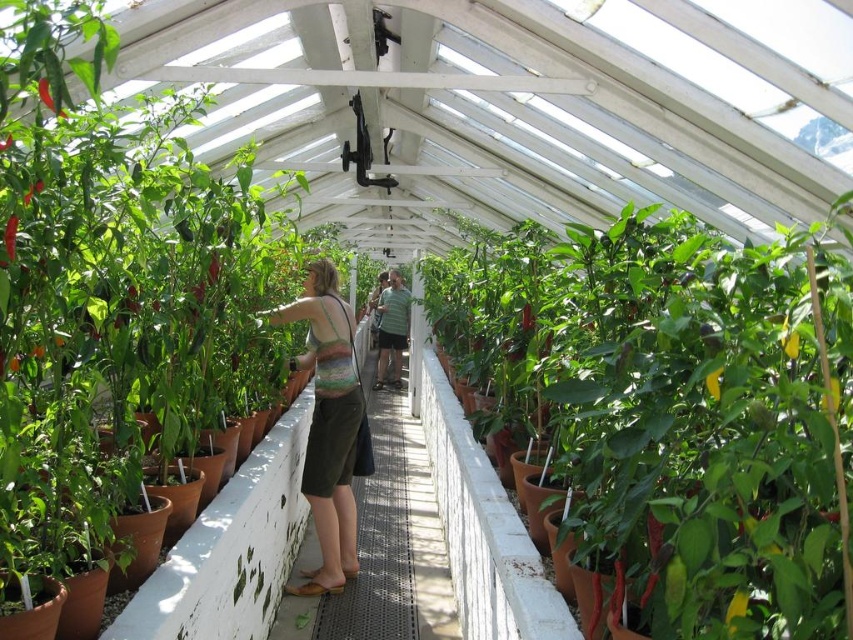
You are standing at the entrance of the greenhouse and see the point marked at coordinates (671, 406). What object is located at that point?

The point at coordinates (671, 406) marks the green matte pot at center.

You are a gardener wearing a green striped shirt at center and need to water the plants. You see a green matte pot at center. Which direction should you move to reach the pot first?

The green matte pot at center is to the right of the green striped shirt at center, so you should move to the right to reach the pot first.

You are a gardener working in the greenhouse and notice both the green matte pot at center and the multicolored knitted tank top at center. From your perspective standing at the entrance, which object is positioned to the right?

The green matte pot at center is to the right of the multicolored knitted tank top at center.